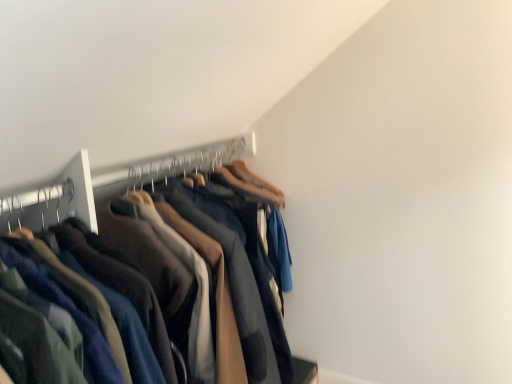
What do you see at coordinates (136, 283) in the screenshot?
I see `dark blue cotton pants at center` at bounding box center [136, 283].

Identify the location of dark blue cotton pants at center. This screenshot has width=512, height=384. (136, 283).

I want to click on wooden hanger at upper center, so click(185, 162).

This screenshot has width=512, height=384. Describe the element at coordinates (185, 162) in the screenshot. I see `wooden hanger at upper center` at that location.

Locate an element on the screen. dark blue cotton pants at center is located at coordinates (136, 283).

Which object is positioned more to the right, dark blue cotton pants at center or wooden hanger at upper center?

wooden hanger at upper center is more to the right.

Between dark blue cotton pants at center and wooden hanger at upper center, which one is positioned behind?

Positioned behind is wooden hanger at upper center.

Which is in front, point (273, 381) or point (148, 169)?

The point (148, 169) is closer.

From the image's perspective, is dark blue cotton pants at center located beneath wooden hanger at upper center?

Correct, dark blue cotton pants at center appears lower than wooden hanger at upper center in the image.

From a real-world perspective, which is physically above, dark blue cotton pants at center or wooden hanger at upper center?

wooden hanger at upper center is physically above.

Considering the sizes of dark blue cotton pants at center and wooden hanger at upper center in the image, is dark blue cotton pants at center wider or thinner than wooden hanger at upper center?

Considering their sizes, dark blue cotton pants at center looks broader than wooden hanger at upper center.

Can you confirm if dark blue cotton pants at center is taller than wooden hanger at upper center?

Yes.

Can you confirm if dark blue cotton pants at center is bigger than wooden hanger at upper center?

Indeed, dark blue cotton pants at center has a larger size compared to wooden hanger at upper center.

Is dark blue cotton pants at center spatially inside wooden hanger at upper center, or outside of it?

dark blue cotton pants at center exists outside the volume of wooden hanger at upper center.

Can you see dark blue cotton pants at center touching wooden hanger at upper center?

They are not placed beside each other.

Is dark blue cotton pants at center aimed at wooden hanger at upper center?

No, dark blue cotton pants at center is not facing towards wooden hanger at upper center.

How many degrees apart are the facing directions of dark blue cotton pants at center and wooden hanger at upper center?

2.67 degrees.

How far apart are dark blue cotton pants at center and wooden hanger at upper center?

The distance of dark blue cotton pants at center from wooden hanger at upper center is 14.78 inches.

Locate an element on the screen. This screenshot has height=384, width=512. hanger that appears above the dark blue cotton pants at center (from a real-world perspective) is located at coordinates (185, 162).

Between wooden hanger at upper center and dark blue cotton pants at center, which one appears on the left side from the viewer's perspective?

dark blue cotton pants at center.

Which object is closer to the camera taking this photo, wooden hanger at upper center or dark blue cotton pants at center?

dark blue cotton pants at center is more forward.

Does point (131, 183) lie in front of point (119, 326)?

No, it is not.

From the image's perspective, which is above, wooden hanger at upper center or dark blue cotton pants at center?

wooden hanger at upper center.

From a real-world perspective, between wooden hanger at upper center and dark blue cotton pants at center, who is vertically higher?

In real-world perspective, wooden hanger at upper center is above.

Which of these two, wooden hanger at upper center or dark blue cotton pants at center, is thinner?

Thinner between the two is wooden hanger at upper center.

In terms of height, does wooden hanger at upper center look taller or shorter compared to dark blue cotton pants at center?

Clearly, wooden hanger at upper center is shorter compared to dark blue cotton pants at center.

Based on their sizes in the image, would you say wooden hanger at upper center is bigger or smaller than dark blue cotton pants at center?

Considering their sizes, wooden hanger at upper center takes up less space than dark blue cotton pants at center.

Is dark blue cotton pants at center located within wooden hanger at upper center?

Definitely not — dark blue cotton pants at center is not inside wooden hanger at upper center.

Can you see wooden hanger at upper center touching dark blue cotton pants at center?

They are not placed beside each other.

Could you tell me if wooden hanger at upper center is turned towards dark blue cotton pants at center?

No, wooden hanger at upper center is not facing towards dark blue cotton pants at center.

How many degrees apart are the facing directions of wooden hanger at upper center and dark blue cotton pants at center?

The angle between the facing direction of wooden hanger at upper center and the facing direction of dark blue cotton pants at center is 2.67 degrees.

The width and height of the screenshot is (512, 384). Identify the location of hanger above the dark blue cotton pants at center (from the image's perspective). (185, 162).

I want to click on hanger on the right of dark blue cotton pants at center, so click(185, 162).

The height and width of the screenshot is (384, 512). In order to click on hanger lying above the dark blue cotton pants at center (from the image's perspective) in this screenshot , I will do `click(185, 162)`.